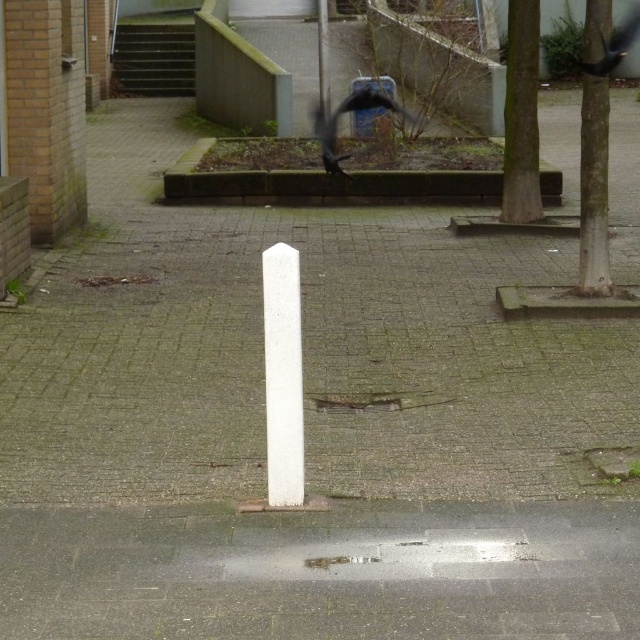
Question: Which object appears farthest from the camera in this image?

Choices:
 (A) white stone post at center
 (B) gray concrete pavement at center

Answer: (A)

Question: Does gray concrete pavement at center come in front of white stone post at center?

Choices:
 (A) yes
 (B) no

Answer: (A)

Question: Does gray concrete pavement at center come in front of white stone post at center?

Choices:
 (A) no
 (B) yes

Answer: (B)

Question: Is gray concrete pavement at center above white stone post at center?

Choices:
 (A) yes
 (B) no

Answer: (B)

Question: Which object appears closest to the camera in this image?

Choices:
 (A) gray concrete pavement at center
 (B) white stone post at center

Answer: (A)